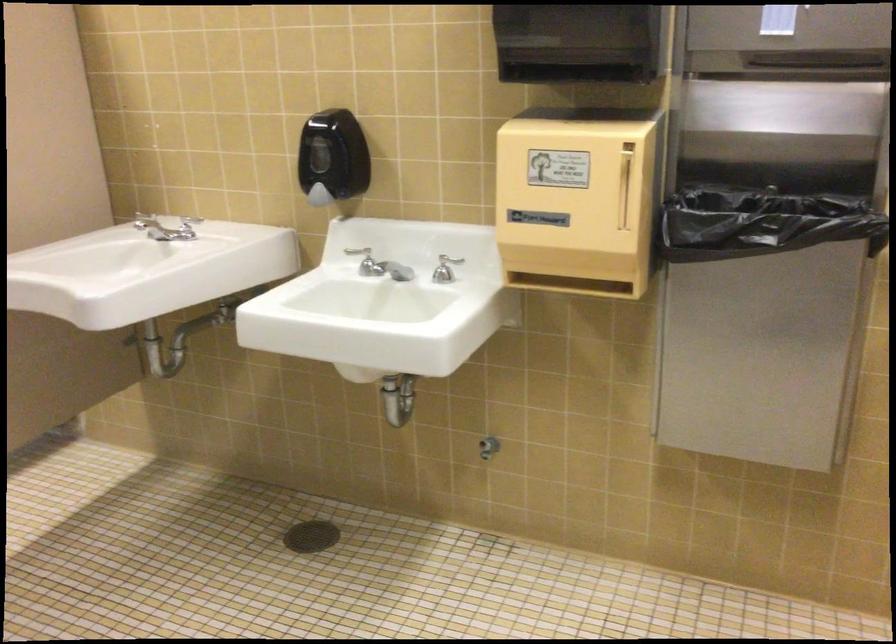
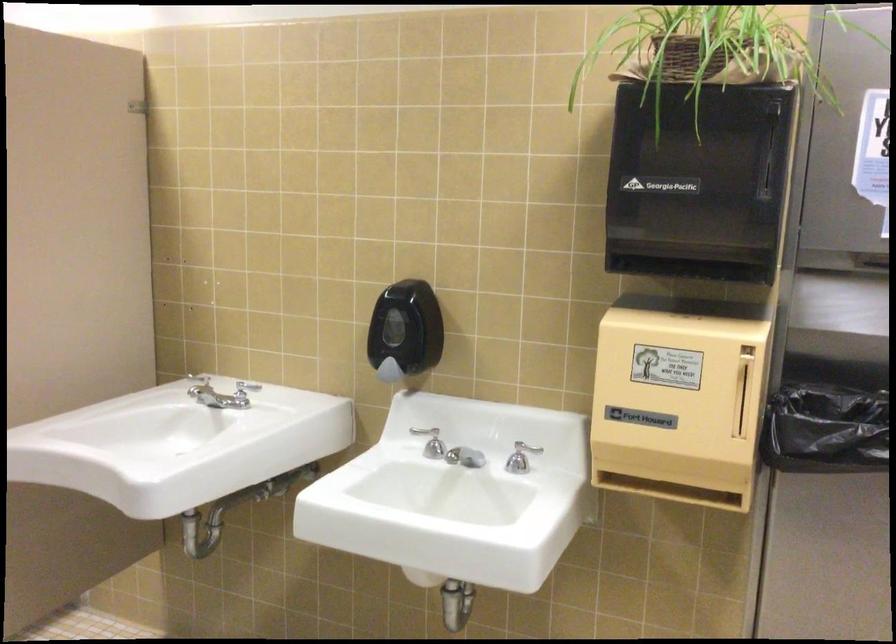
In the second image, find the point that corresponds to point 444,274 in the first image.

(521, 458)